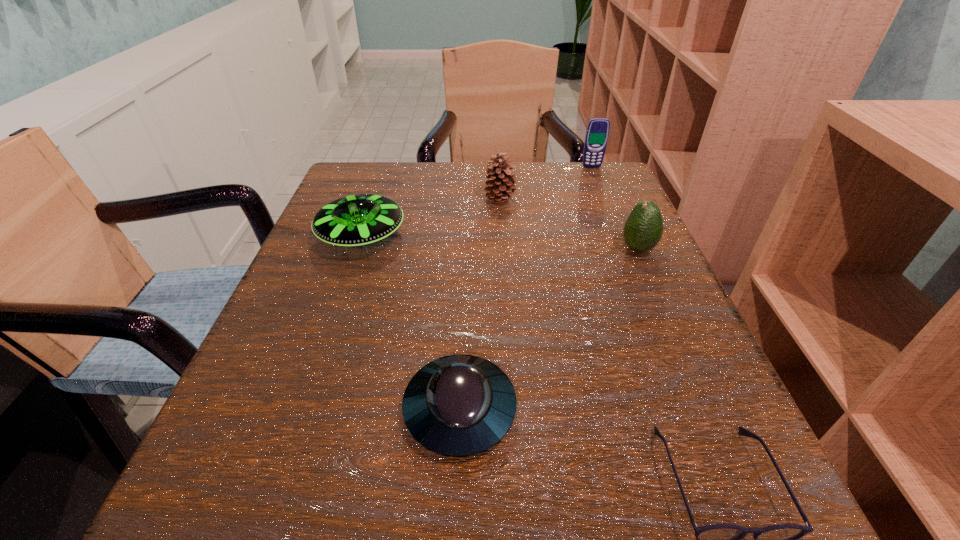
The width and height of the screenshot is (960, 540). In order to click on cellular telephone in this screenshot , I will do `click(597, 132)`.

Image resolution: width=960 pixels, height=540 pixels. In order to click on the second farthest object in this screenshot , I will do `click(504, 179)`.

The image size is (960, 540). Identify the location of avocado. (643, 229).

I want to click on the farther saucer, so click(x=358, y=220).

Locate an element on the screen. The width and height of the screenshot is (960, 540). the left saucer is located at coordinates (358, 220).

I want to click on the right saucer, so (x=460, y=405).

Identify the location of the nearer saucer. The width and height of the screenshot is (960, 540). (460, 405).

Locate an element on the screen. The image size is (960, 540). free region located 0.380m on the front-facing side of the farthest object is located at coordinates (632, 267).

I want to click on vacant space situated on the front of the pinecone, so click(508, 319).

Where is `free space located 0.260m on the back of the avocado`? free space located 0.260m on the back of the avocado is located at coordinates (605, 174).